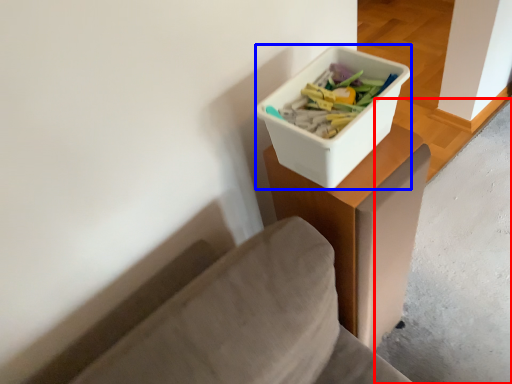
Question: Which object appears closest to the camera in this image, concrete (highlighted by a red box) or storage box (highlighted by a blue box)?

Choices:
 (A) concrete
 (B) storage box

Answer: (B)